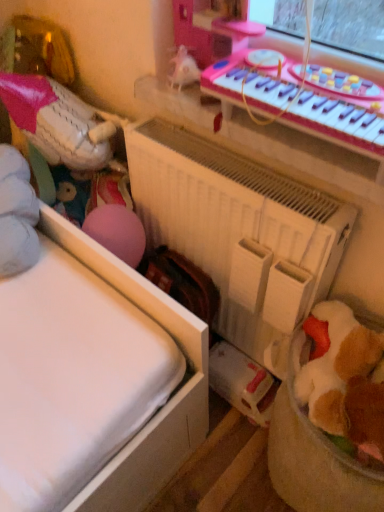
The image size is (384, 512). What are the coordinates of `free point above pink plastic musical keyboard at upper right (from a real-world perspective)` in the screenshot? It's located at (315, 75).